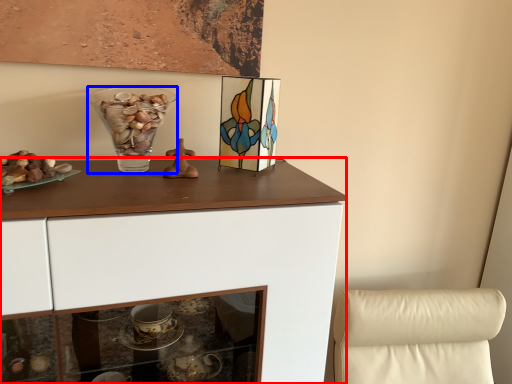
Question: Which point is further to the camera, cabinetry (highlighted by a red box) or vase (highlighted by a blue box)?

Choices:
 (A) cabinetry
 (B) vase

Answer: (B)